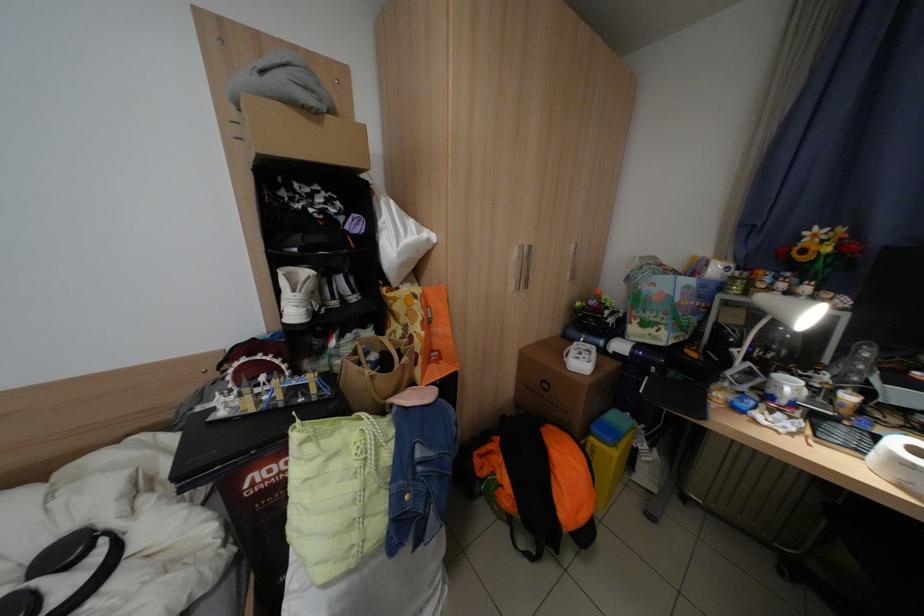
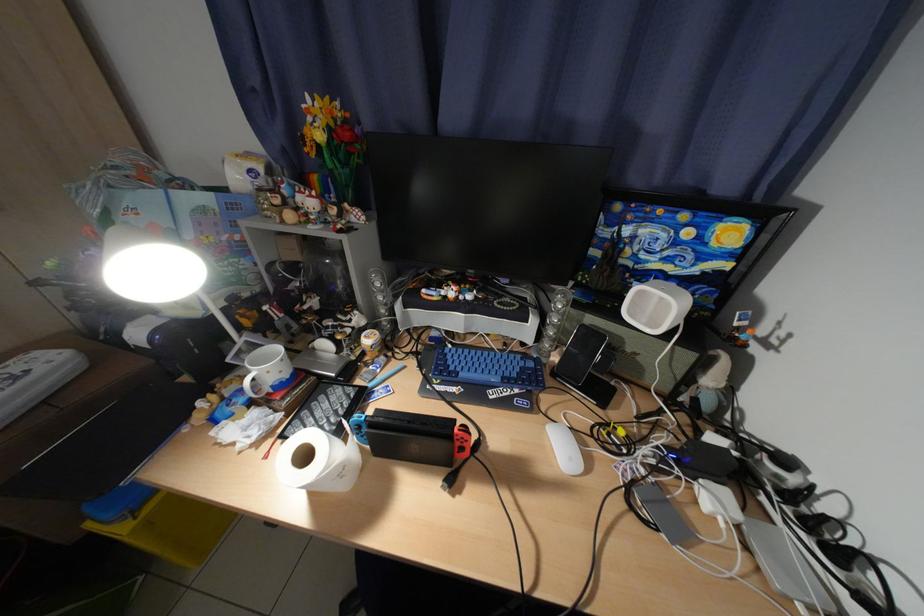
Where in the second image is the point corresponding to (x=861, y=399) from the first image?

(381, 341)